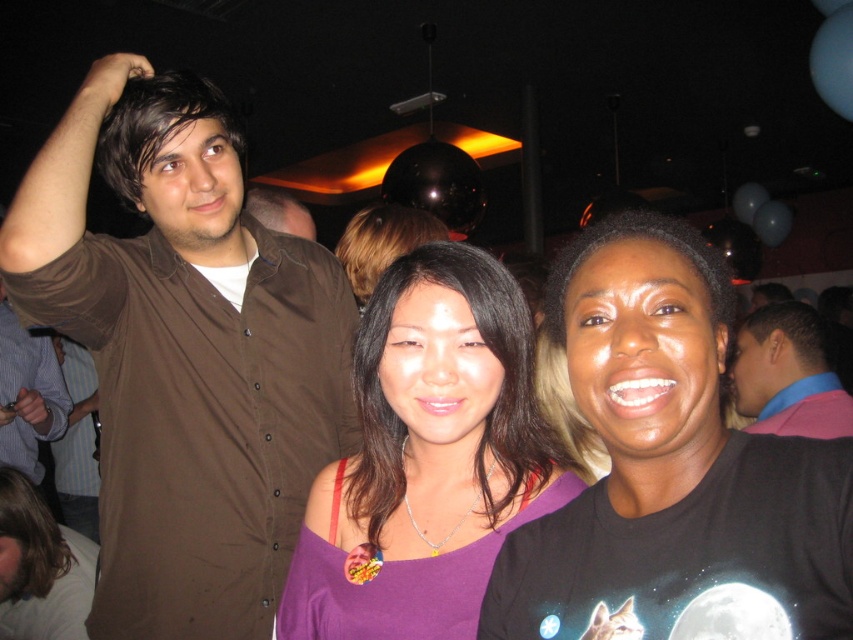
You are standing in the room and want to take a photo of both the disco ball and the balloons. You notice two points in the image labeled as point 1 at coordinates (45, 364) and point 2 at coordinates (418, 211). Which point should you focus on to ensure both the disco ball and balloons are in focus?

You should focus on point 2 at coordinates (418, 211) because it is closer to the camera than point 1, allowing both the disco ball and balloons to be in focus.